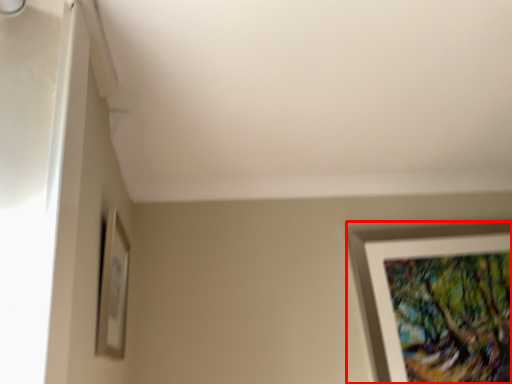
Question: From the image's perspective, where is picture frame (annotated by the red box) located in relation to picture frame in the image?

Choices:
 (A) below
 (B) above

Answer: (A)